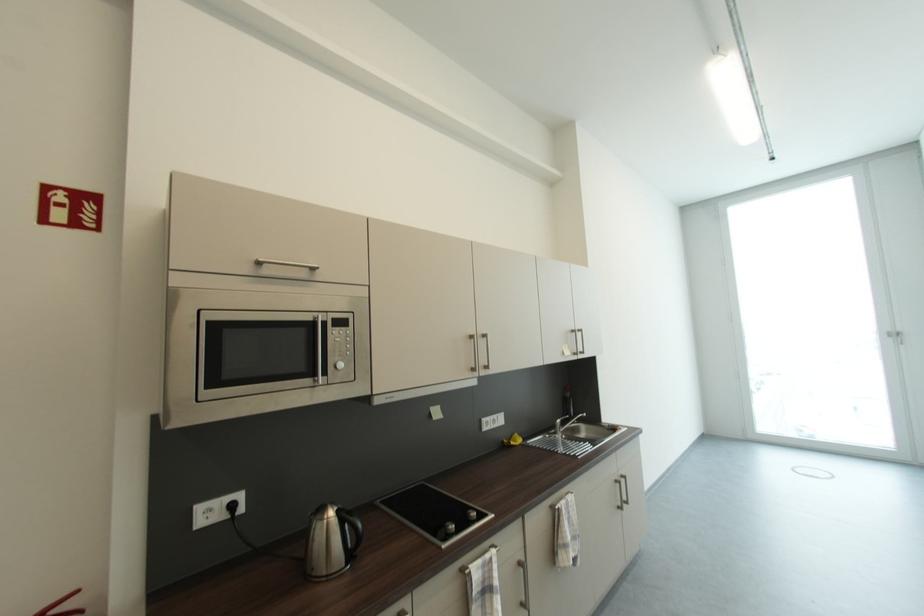
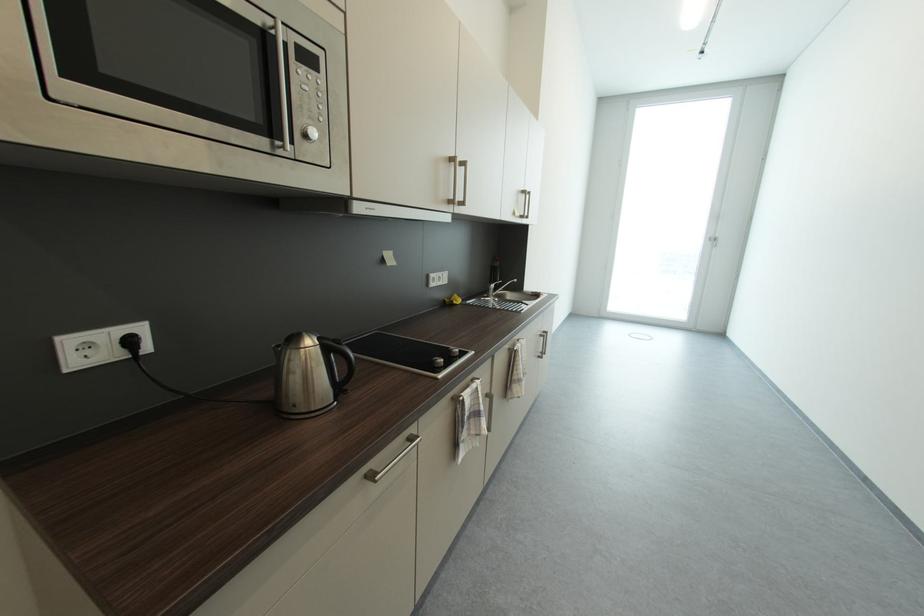
First-person continuous shooting, in which direction is the camera rotating?

The rotation direction of the camera is right-down.